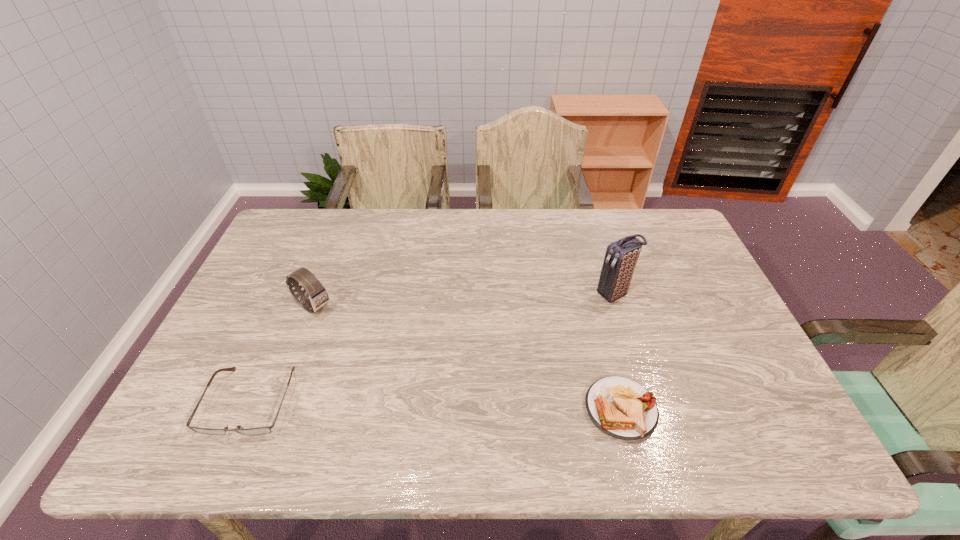
Locate an element on the screen. The image size is (960, 540). vacant spot on the desktop that is between the spectacles and the sandwich and is positioned on the face of the watch is located at coordinates (451, 406).

Identify the location of vacant spot on the desktop that is between the spectacles and the sandwich and is positioned with the zip open on the clutch bag. (387, 404).